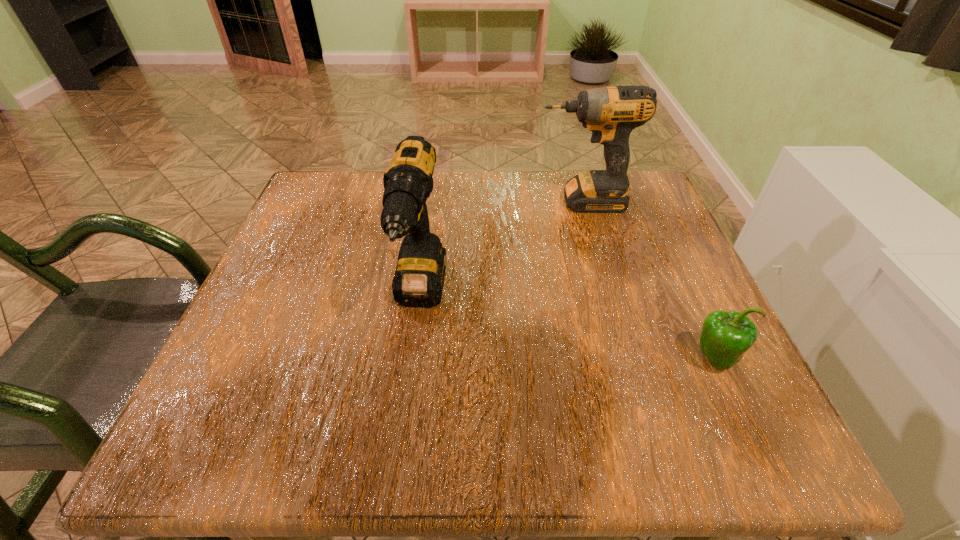
Locate an element on the screen. The image size is (960, 540). vacant area that lies between the farthest object and the bell pepper is located at coordinates (648, 280).

The width and height of the screenshot is (960, 540). I want to click on free area in between the bell pepper and the left drill, so click(x=567, y=328).

Locate an element on the screen. free space between the shortest object and the farther drill is located at coordinates (648, 280).

Where is `empty location between the shortest object and the right drill`? Image resolution: width=960 pixels, height=540 pixels. empty location between the shortest object and the right drill is located at coordinates (648, 280).

The width and height of the screenshot is (960, 540). I want to click on empty space that is in between the shortest object and the nearer drill, so click(x=567, y=328).

Locate an element on the screen. free space between the left drill and the farther drill is located at coordinates (501, 249).

Locate an element on the screen. The height and width of the screenshot is (540, 960). vacant area that lies between the shortest object and the farther drill is located at coordinates click(x=648, y=280).

Where is `free space between the bell pepper and the left drill`? The width and height of the screenshot is (960, 540). free space between the bell pepper and the left drill is located at coordinates (567, 328).

This screenshot has width=960, height=540. In order to click on vacant area between the farthest object and the shortest object in this screenshot , I will do `click(648, 280)`.

Find the location of `free space that is in between the farthest object and the leftmost object`. free space that is in between the farthest object and the leftmost object is located at coordinates (501, 249).